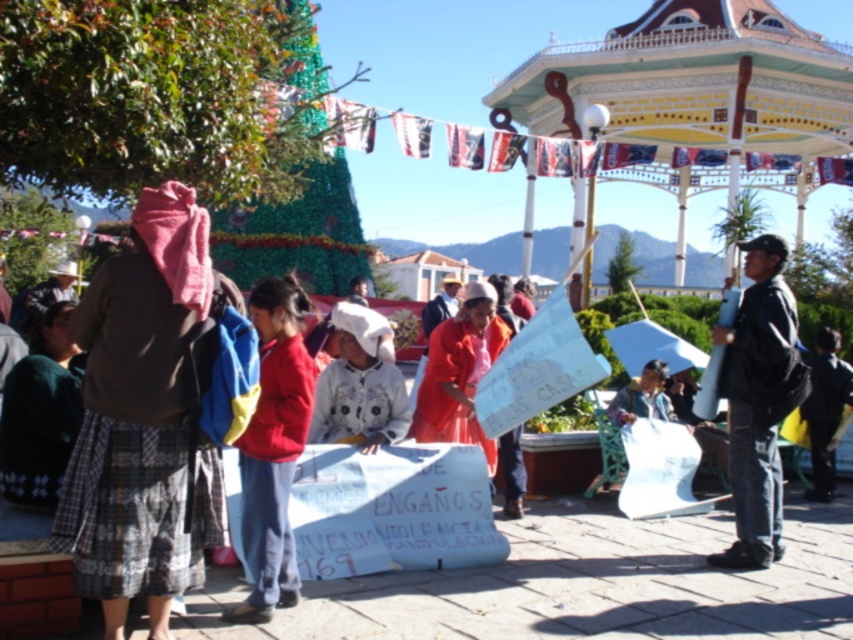
Consider the image. You are a photographer standing in the plaza and want to take a photo of both the black leather jacket at right and the white fabric at center. Which object will appear larger in your photo?

The black leather jacket at right is closer to the viewer than the white fabric at center, so it will appear larger in the photo.

You are a photographer standing in the plaza and want to take a photo of both the decorative painted wood gazebo at upper right and the black leather jacket at right. Which object should you position to the left side of your photo frame to include both in the shot?

You should position the black leather jacket at right to the left side of your photo frame because the decorative painted wood gazebo at upper right is located to the right of the black leather jacket at right.